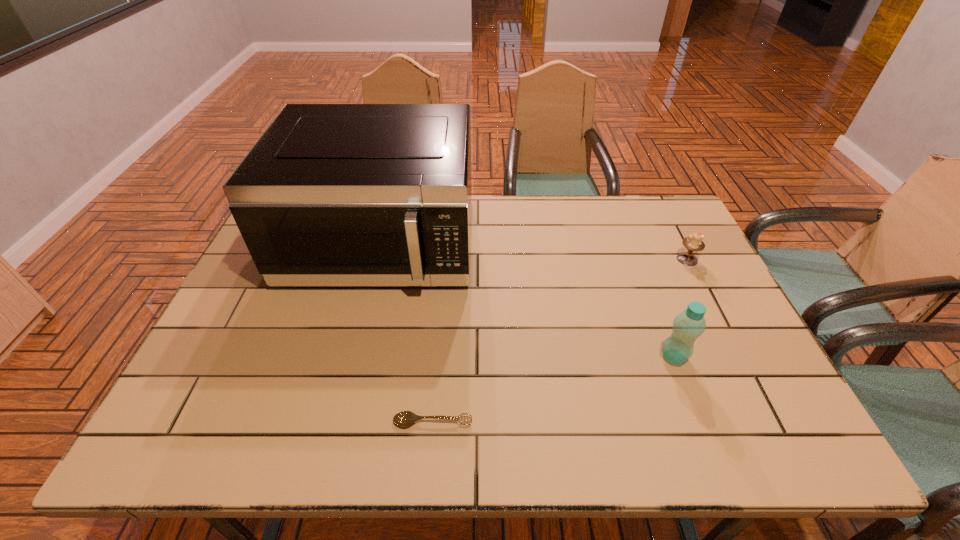
This screenshot has height=540, width=960. What are the coordinates of `vacant space at the far right corner` in the screenshot? It's located at (665, 228).

The image size is (960, 540). Identify the location of vacant area that lies between the rightmost object and the ladle. (560, 340).

Where is `empty location between the rightmost object and the nearest object`? Image resolution: width=960 pixels, height=540 pixels. empty location between the rightmost object and the nearest object is located at coordinates (560, 340).

Where is `vacant space that's between the third tallest object and the nearest object`? The width and height of the screenshot is (960, 540). vacant space that's between the third tallest object and the nearest object is located at coordinates (560, 340).

Where is `vacant region between the third shortest object and the tallest object`? The width and height of the screenshot is (960, 540). vacant region between the third shortest object and the tallest object is located at coordinates (527, 301).

You are a GUI agent. You are given a task and a screenshot of the screen. Output one action in this format:
    pyautogui.click(x=<x>, y=<y>)
    Task: Click on the free space between the ladle and the microwave_oven
    Image resolution: width=960 pixels, height=540 pixels.
    Given the screenshot: What is the action you would take?
    pyautogui.click(x=407, y=333)

The image size is (960, 540). Identify the location of vacant space that is in between the shortest object and the microwave_oven. [x=407, y=333].

Where is `free point between the second nearest object and the ladle`? free point between the second nearest object and the ladle is located at coordinates (553, 389).

Identify the location of empty location between the ladle and the rightmost object. The height and width of the screenshot is (540, 960). (560, 340).

The width and height of the screenshot is (960, 540). I want to click on free space between the third tallest object and the third object from left to right, so click(681, 308).